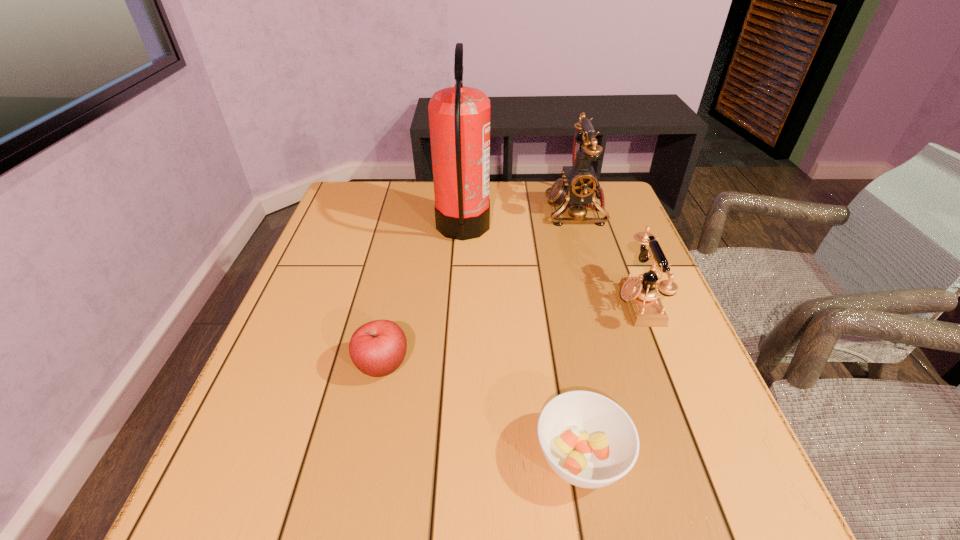
Locate an element on the screen. fire extinguisher is located at coordinates (459, 117).

Where is `the tallest object`? This screenshot has width=960, height=540. the tallest object is located at coordinates (459, 117).

Identify the location of the farther telephone. (580, 184).

At what (x,y) coordinates should I click in order to perform the action: click on the second tallest object. Please return your answer as a coordinate pair (x, y). Looking at the image, I should click on (580, 184).

Where is `the nearer telephone`? the nearer telephone is located at coordinates (640, 294).

You are a GUI agent. You are given a task and a screenshot of the screen. Output one action in this format:
    pyautogui.click(x=<x>, y=<y>)
    Task: Click on the shorter telephone
    The image size is (960, 540).
    Given the screenshot: What is the action you would take?
    pyautogui.click(x=640, y=294)

Find the location of a particular element. The image size is (960, 540). the fourth farthest object is located at coordinates (377, 348).

The width and height of the screenshot is (960, 540). In order to click on apple in this screenshot , I will do `click(377, 348)`.

You are a GUI agent. You are given a task and a screenshot of the screen. Output one action in this format:
    pyautogui.click(x=<x>, y=<y>)
    Task: Click on the nearest object
    This screenshot has height=540, width=960.
    Given the screenshot: What is the action you would take?
    [588, 440]

Locate an element on the screen. The image size is (960, 540). the shortest object is located at coordinates click(588, 440).